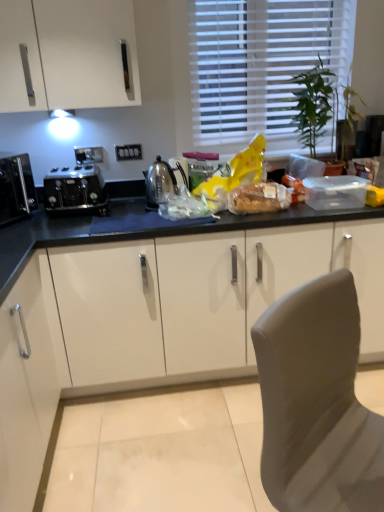
Question: From the image's perspective, is green leafy plant at upper right positioned above or below satin silver kettle at center?

Choices:
 (A) above
 (B) below

Answer: (A)

Question: In the image, is green leafy plant at upper right on the left side or the right side of satin silver kettle at center?

Choices:
 (A) left
 (B) right

Answer: (B)

Question: Considering the real-world distances, which object is farthest from the translucent plastic bag at center, marked as the first food in a left-to-right arrangement?

Choices:
 (A) white matte cabinet at lower left
 (B) matte brown bread at center, which is the 1th food in right-to-left order
 (C) black glossy microwave at left, marked as the 2th kitchen appliance in a right-to-left arrangement
 (D) green leafy plant at upper right
 (E) black metallic toaster at left, the second kitchen appliance positioned from the left

Answer: (D)

Question: Which object is positioned farthest from the black metallic toaster at left, which appears as the first kitchen appliance when viewed from the right?

Choices:
 (A) white blinds at upper center
 (B) translucent plastic bag at center, marked as the first food in a left-to-right arrangement
 (C) satin silver kettle at center
 (D) matte brown bread at center, which is the 1th food in right-to-left order
 (E) black glossy microwave at left, the 1th kitchen appliance viewed from the left

Answer: (A)